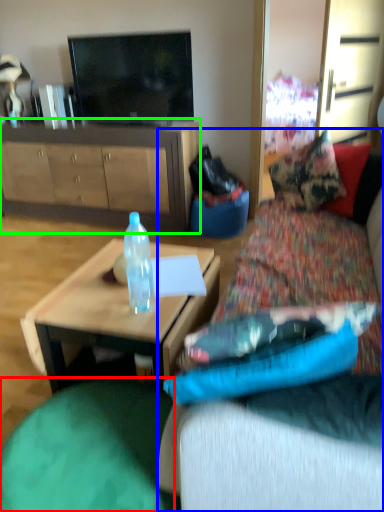
Question: Which object is the farthest from bean bag chair (highlighted by a red box)? Choose among these: studio couch (highlighted by a blue box) or cabinetry (highlighted by a green box).

Choices:
 (A) studio couch
 (B) cabinetry

Answer: (B)